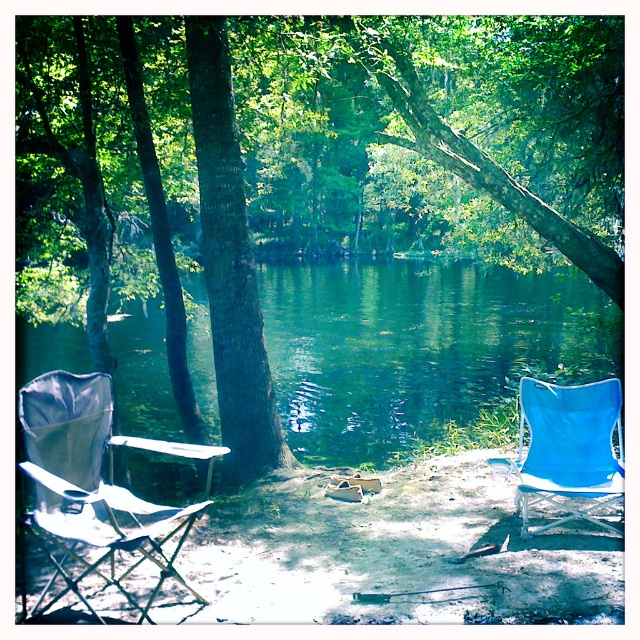
You are standing at the edge of the lake and want to place a small floating dock at point (419, 348). According to the scene description, what will the dock be placed on?

The dock will be placed on the green translucent water at center located at point (419, 348).

You are planning to set up a picnic table between the green rough bark tree at center and the silver metallic beach chair at left. Based on their positions, which object should you place the picnic table closer to in order to keep it aligned with the existing items?

The picnic table should be placed closer to the silver metallic beach chair at left since the green rough bark tree at center is on the right side of the silver metallic beach chair at left, creating a natural alignment path between them.

You are standing at the edge of the lake and want to take a photo of the point at coordinates point (58, 180). If your camera has a maximum focus range of 40 feet, will you be able to capture the point clearly?

The distance of point (58, 180) from the camera is 42.39 feet, which exceeds the camera maximum focus range of 40 feet. Therefore, you won not be able to capture the point clearly.